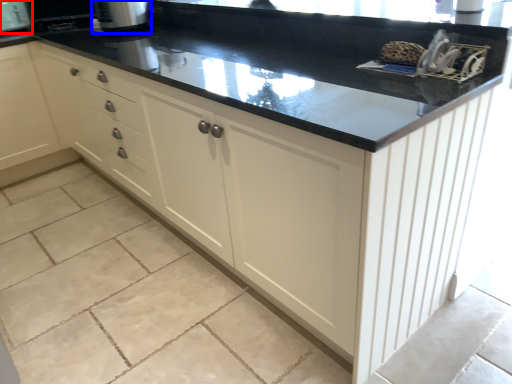
Question: Which of the following is the closest to the observer, appliance (highlighted by a red box) or appliance (highlighted by a blue box)?

Choices:
 (A) appliance
 (B) appliance

Answer: (B)